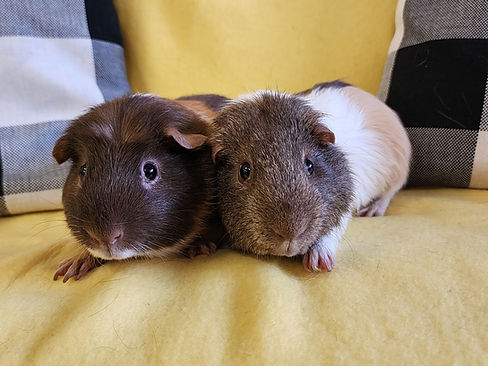
Image resolution: width=488 pixels, height=366 pixels. In order to click on black squares on throw pillows in this screenshot , I will do `click(430, 77)`, `click(106, 16)`.